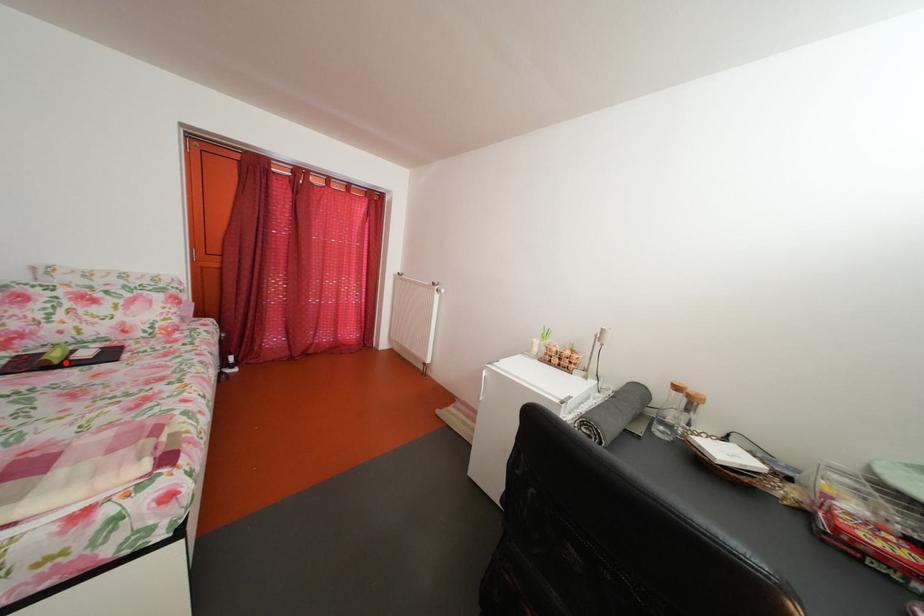
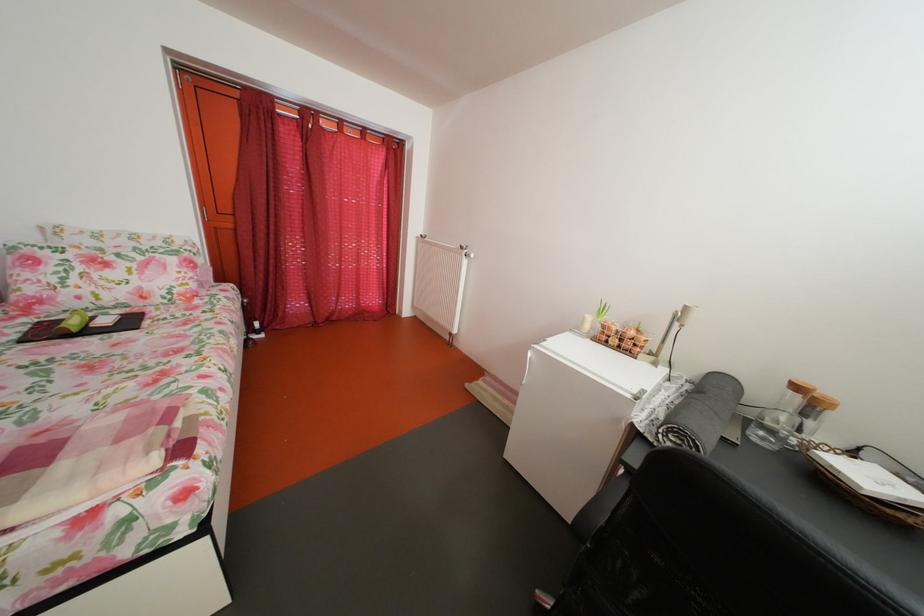
The point at the highlighted location is marked in the first image. Where is the corresponding point in the second image?

(83, 330)